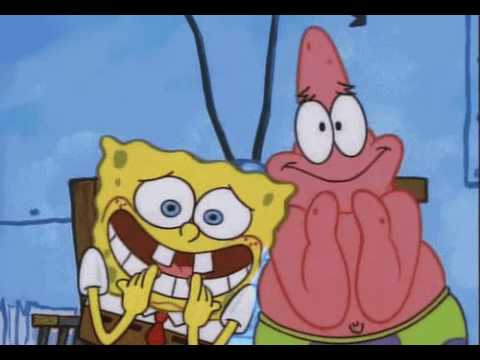
Where is `television screen`? television screen is located at coordinates (246, 337).